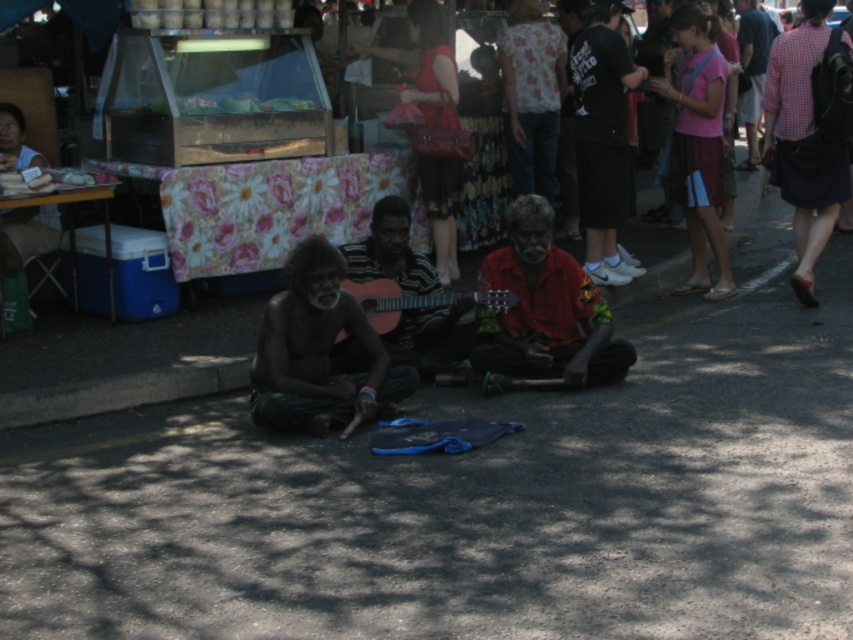
In the scene shown: You are a photographer standing on the street. You want to take a picture of the wooden guitar at center and the pink cotton shirt at upper right. Based on their positions, which object should you focus on first to ensure both are in frame?

The wooden guitar at center is below the pink cotton shirt at upper right, so you should focus on the pink cotton shirt at upper right first to ensure both are in frame.

Based on the photo, you are a street performer who wants to carry both guitars to the nearby music store. The store is located to the left of the market area. Given that the shiny black guitar at center is wider than the wooden guitar at center, which guitar should you place on your left side to ensure easier carrying?

You should place the shiny black guitar at center on your left side because it is wider than the wooden guitar at center, making it easier to balance and carry while moving towards the store on the left.

You are a street performer who wants to place your wooden guitar at center on the ground without covering the red matte shirt at center. Based on their sizes, is this possible?

The red matte shirt at center is much taller than the wooden guitar at center, so placing the wooden guitar at center on the ground might not cover the red matte shirt at center if positioned carefully.